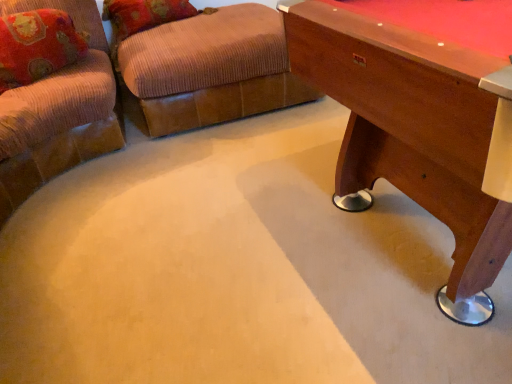
Describe the element at coordinates (207, 70) in the screenshot. I see `brown corduroy ottoman at upper center` at that location.

What are the coordinates of `wooden pool table at right` in the screenshot? It's located at (421, 123).

Is wooden pool table at right completely or partially inside brown corduroy ottoman at upper center?

No.

Is brown corduroy ottoman at upper center taller than wooden pool table at right?

Incorrect, the height of brown corduroy ottoman at upper center is not larger of that of wooden pool table at right.

From the image's perspective, is brown corduroy ottoman at upper center located above wooden pool table at right?

Indeed, from the image's perspective, brown corduroy ottoman at upper center is shown above wooden pool table at right.

Is velvet floral pillow at upper left beside brown corduroy ottoman at upper center?

No.

Measure the distance between velvet floral pillow at upper left and brown corduroy ottoman at upper center.

A distance of 23.69 inches exists between velvet floral pillow at upper left and brown corduroy ottoman at upper center.

Does velvet floral pillow at upper left have a lesser height compared to brown corduroy ottoman at upper center?

Correct, velvet floral pillow at upper left is not as tall as brown corduroy ottoman at upper center.

Locate an element on the screen. swivel chair behind the velvet floral pillow at upper left is located at coordinates (207, 70).

Which object is positioned more to the right, wooden pool table at right or brown corduroy ottoman at upper center?

From the viewer's perspective, wooden pool table at right appears more on the right side.

Would you say wooden pool table at right is inside or outside brown corduroy ottoman at upper center?

wooden pool table at right is outside brown corduroy ottoman at upper center.

From the image's perspective, is wooden pool table at right beneath brown corduroy ottoman at upper center?

Indeed, from the image's perspective, wooden pool table at right is shown beneath brown corduroy ottoman at upper center.

Which is in front, point (403, 161) or point (165, 130)?

The point (403, 161) is closer to the camera.

Is velvet floral pillow at upper left turned away from wooden pool table at right?

No, velvet floral pillow at upper left's orientation is not away from wooden pool table at right.

Which object is closer to the camera taking this photo, velvet floral pillow at upper left or wooden pool table at right?

Positioned in front is wooden pool table at right.

Can you confirm if velvet floral pillow at upper left is positioned to the right of wooden pool table at right?

No.

Is point (64, 27) closer or farther from the camera than point (301, 65)?

Point (64, 27).

Which object is thinner, brown corduroy ottoman at upper center or velvet floral pillow at upper left?

velvet floral pillow at upper left is thinner.

In the scene shown: Which point is more forward, (x=263, y=24) or (x=34, y=13)?

The point (x=34, y=13) is in front.

Is brown corduroy ottoman at upper center not near velvet floral pillow at upper left?

No, brown corduroy ottoman at upper center is not far from velvet floral pillow at upper left.

Based on the photo, choose the correct answer: Is brown corduroy ottoman at upper center inside velvet floral pillow at upper left or outside it?

brown corduroy ottoman at upper center is spatially situated outside velvet floral pillow at upper left.

Looking at this image, can you tell me how much wooden pool table at right and velvet floral pillow at upper left differ in facing direction?

There is a 164-degree angle between the facing directions of wooden pool table at right and velvet floral pillow at upper left.

From the picture: Is wooden pool table at right in front of velvet floral pillow at upper left?

That is True.

Is wooden pool table at right far away from velvet floral pillow at upper left?

Yes, wooden pool table at right is far from velvet floral pillow at upper left.

Which of these two, wooden pool table at right or velvet floral pillow at upper left, stands shorter?

velvet floral pillow at upper left.

The height and width of the screenshot is (384, 512). In order to click on table located below the brown corduroy ottoman at upper center (from the image's perspective) in this screenshot , I will do `click(421, 123)`.

The image size is (512, 384). Identify the location of swivel chair that is under the velvet floral pillow at upper left (from a real-world perspective). (207, 70).

Looking at this image, which object lies nearer to the anchor point velvet floral pillow at upper left, brown corduroy ottoman at upper center or wooden pool table at right?

brown corduroy ottoman at upper center lies closer to velvet floral pillow at upper left than the other object.

Consider the image. Based on their spatial positions, is velvet floral pillow at upper left or brown corduroy ottoman at upper center further from wooden pool table at right?

Among the two, velvet floral pillow at upper left is located further to wooden pool table at right.

When comparing their distances from velvet floral pillow at upper left, does wooden pool table at right or brown corduroy ottoman at upper center seem further?

wooden pool table at right is positioned further to the anchor velvet floral pillow at upper left.

From the picture: Considering their positions, is velvet floral pillow at upper left positioned closer to brown corduroy ottoman at upper center than wooden pool table at right?

velvet floral pillow at upper left is closer to brown corduroy ottoman at upper center.

Estimate the real-world distances between objects in this image. Which object is further from brown corduroy ottoman at upper center, wooden pool table at right or velvet floral pillow at upper left?

Among the two, wooden pool table at right is located further to brown corduroy ottoman at upper center.

Considering their positions, is brown corduroy ottoman at upper center positioned further to wooden pool table at right than velvet floral pillow at upper left?

velvet floral pillow at upper left is further to wooden pool table at right.

At what (x,y) coordinates should I click in order to perform the action: click on swivel chair situated between velvet floral pillow at upper left and wooden pool table at right from left to right. Please return your answer as a coordinate pair (x, y). The width and height of the screenshot is (512, 384). Looking at the image, I should click on (207, 70).